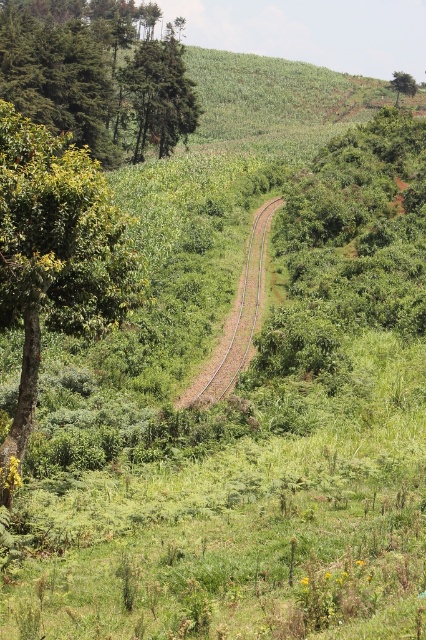
Which is in front, point (127, 278) or point (255, 256)?

Point (127, 278) is in front.

Does green leafy tree at left appear on the left side of brown metallic train track at center?

Correct, you'll find green leafy tree at left to the left of brown metallic train track at center.

Who is more forward, (45, 176) or (236, 369)?

Positioned in front is point (45, 176).

Where is `green leafy tree at left`? The height and width of the screenshot is (640, 426). green leafy tree at left is located at coordinates (54, 253).

Can you confirm if green leafy tree at left is shorter than green leafy tree at upper right?

Yes.

This screenshot has width=426, height=640. I want to click on green leafy tree at left, so click(x=54, y=253).

Is point (17, 141) closer to viewer compared to point (402, 81)?

Yes.

Locate an element on the screen. This screenshot has height=640, width=426. green leafy tree at left is located at coordinates (54, 253).

Does green leafy tree at left have a lesser height compared to green matte tree at upper left?

Indeed, green leafy tree at left has a lesser height compared to green matte tree at upper left.

Which of these two, green leafy tree at left or green matte tree at upper left, stands shorter?

With less height is green leafy tree at left.

The image size is (426, 640). Find the location of `green leafy tree at left`. green leafy tree at left is located at coordinates (54, 253).

Image resolution: width=426 pixels, height=640 pixels. What are the coordinates of `green leafy tree at left` in the screenshot? It's located at (54, 253).